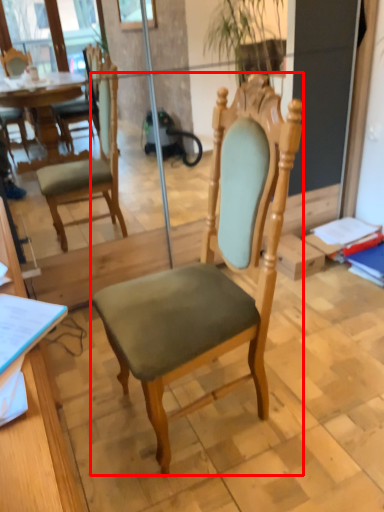
Question: Where is chair (annotated by the red box) located in relation to desk in the image?

Choices:
 (A) left
 (B) right

Answer: (B)